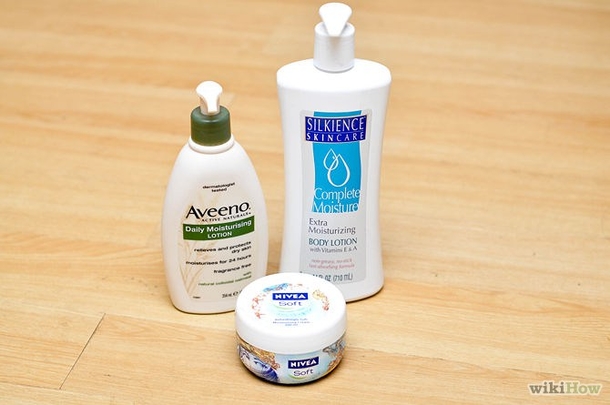
Image resolution: width=610 pixels, height=405 pixels. I want to click on lotion bottle cap, so click(x=217, y=129), click(x=338, y=61).